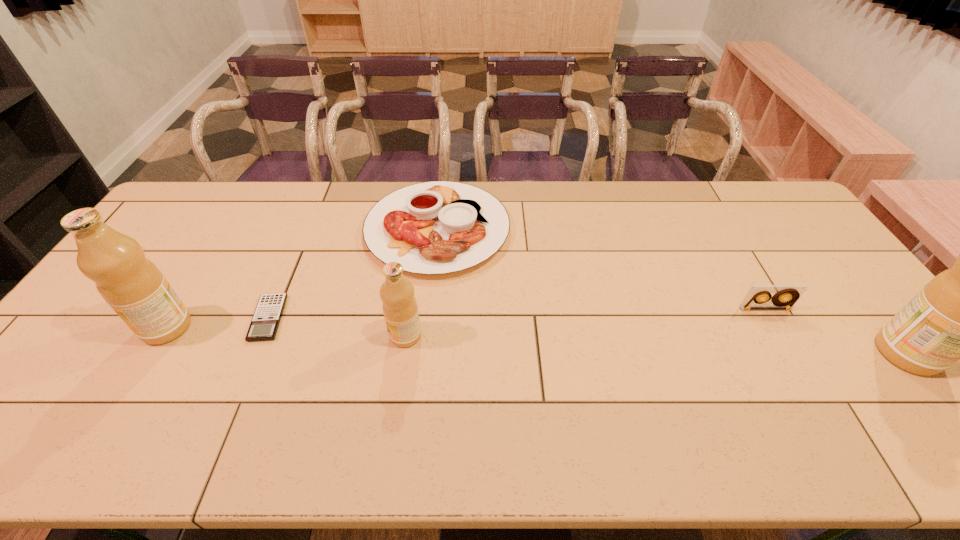
The height and width of the screenshot is (540, 960). Find the location of `the second object from left to right`. the second object from left to right is located at coordinates (265, 322).

The width and height of the screenshot is (960, 540). In order to click on vacant area located 0.150m on the label of the fifth shortest object in this screenshot , I will do `click(87, 327)`.

Where is `free point located on the label of the second olive oil from left to right`? The height and width of the screenshot is (540, 960). free point located on the label of the second olive oil from left to right is located at coordinates (306, 335).

Where is `vacant region located 0.070m on the label of the second olive oil from left to right`? This screenshot has height=540, width=960. vacant region located 0.070m on the label of the second olive oil from left to right is located at coordinates (363, 335).

You are a GUI agent. You are given a task and a screenshot of the screen. Output one action in this format:
    pyautogui.click(x=<x>, y=<y>)
    Task: Click on the vacant space located on the label of the second olive oil from left to right
    Image resolution: width=960 pixels, height=540 pixels.
    Given the screenshot: What is the action you would take?
    pyautogui.click(x=295, y=335)

At what (x,y) coordinates should I click in order to perform the action: click on free space located on the front of the platter. Please return your answer as a coordinate pair (x, y). The image size is (960, 540). Looking at the image, I should click on (421, 384).

You are a GUI agent. You are given a task and a screenshot of the screen. Output one action in this format:
    pyautogui.click(x=<x>, y=<y>)
    Task: Click on the vacant region located at the front of the third shortest object with visible reels
    
    Given the screenshot: What is the action you would take?
    pyautogui.click(x=787, y=347)

You are a GUI agent. You are given a task and a screenshot of the screen. Output one action in this format:
    pyautogui.click(x=<x>, y=<y>)
    Task: Click on the free space located on the front of the calculator
    
    Given the screenshot: What is the action you would take?
    pyautogui.click(x=232, y=402)

Locate an element on the screen. This screenshot has width=960, height=540. object situated at the far edge is located at coordinates (437, 227).

Image resolution: width=960 pixels, height=540 pixels. Find the location of `object present at the near edge`. object present at the near edge is located at coordinates (958, 315).